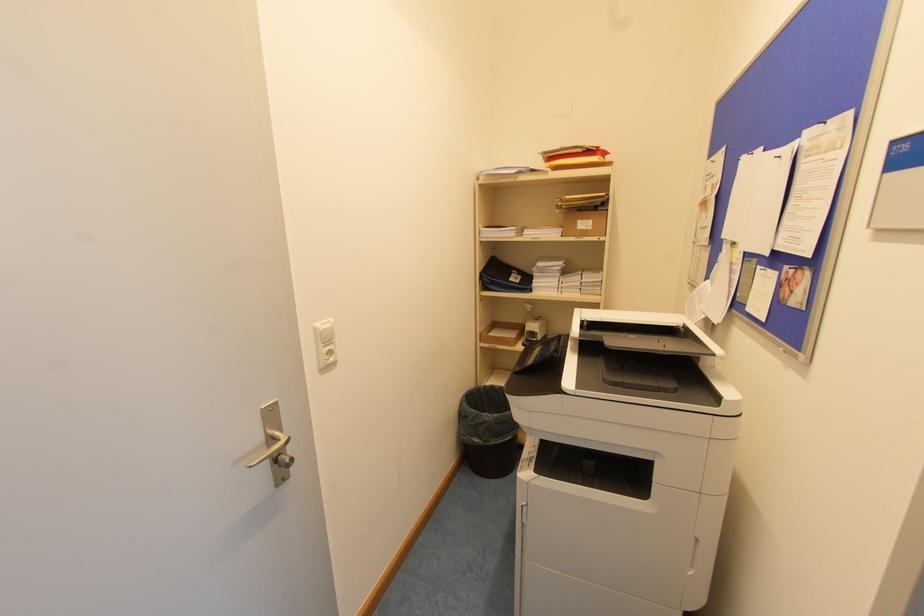
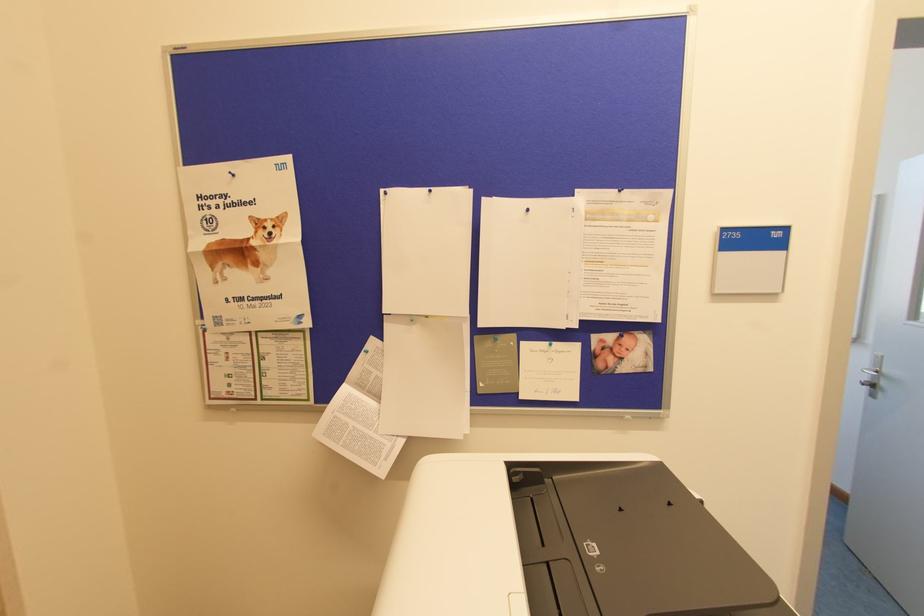
Locate, in the second image, the point that corresponds to point 780,156 in the first image.

(527, 209)